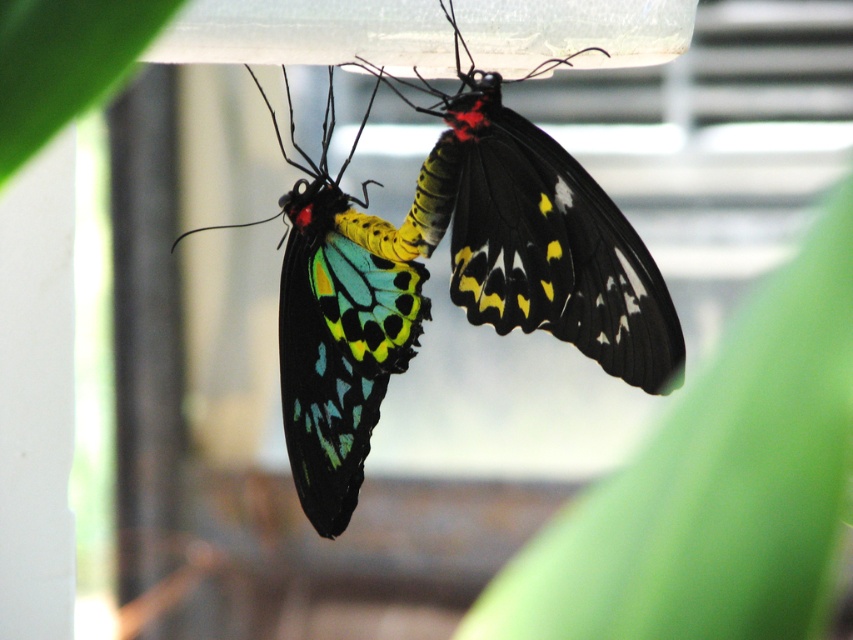
Is point (585, 291) positioned after point (299, 198)?

That is False.

From the picture: Does multicolored iridescent wings at center have a greater width compared to shiny iridescent wings at center?

Yes, multicolored iridescent wings at center is wider than shiny iridescent wings at center.

Is point (653, 360) farther from camera compared to point (386, 292)?

No, (653, 360) is in front of (386, 292).

You are a GUI agent. You are given a task and a screenshot of the screen. Output one action in this format:
    pyautogui.click(x=<x>, y=<y>)
    Task: Click on the multicolored iridescent wings at center
    This screenshot has width=853, height=640.
    Given the screenshot: What is the action you would take?
    pyautogui.click(x=549, y=243)

Does shiny iridescent wings at center appear under green leafy plant at upper left?

Yes, shiny iridescent wings at center is below green leafy plant at upper left.

Does point (334, 385) lie behind point (27, 81)?

Yes, point (334, 385) is farther from viewer.

Is point (297, 444) closer to viewer compared to point (56, 100)?

No, it is not.

Identify the location of shiny iridescent wings at center. The image size is (853, 640). (335, 326).

Between multicolored iridescent wings at center and green leafy plant at upper left, which one has less height?

With less height is green leafy plant at upper left.

Does point (630, 300) come in front of point (4, 131)?

No, it is not.

Does point (608, 240) lie behind point (6, 84)?

Yes, it is.

You are a GUI agent. You are given a task and a screenshot of the screen. Output one action in this format:
    pyautogui.click(x=<x>, y=<y>)
    Task: Click on the multicolored iridescent wings at center
    
    Given the screenshot: What is the action you would take?
    pyautogui.click(x=549, y=243)